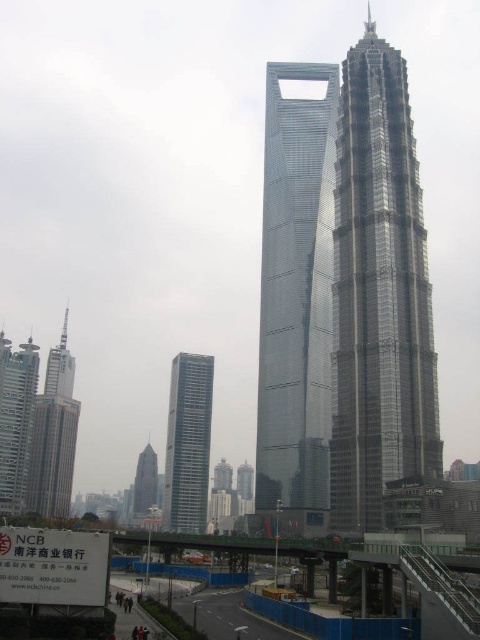
Question: Is shiny glass skyscraper at center thinner than silver glass skyscraper at left?

Choices:
 (A) yes
 (B) no

Answer: (B)

Question: Which object is farther from the camera taking this photo?

Choices:
 (A) shiny glass tower at center
 (B) matte brown skyscraper at center

Answer: (B)

Question: Which of the following is the closest to the observer?

Choices:
 (A) (316, 509)
 (B) (48, 410)
 (C) (144, 449)

Answer: (A)

Question: Can you confirm if shiny glass tower at center is thinner than matte brown skyscraper at center?

Choices:
 (A) no
 (B) yes

Answer: (A)

Question: Which object is closer to the camera taking this photo?

Choices:
 (A) matte brown skyscraper at center
 (B) sleek silver skyscraper at center
 (C) shiny glass skyscraper at center

Answer: (C)

Question: Can you confirm if shiny glass skyscraper at center is positioned to the left of silver glass skyscraper at left?

Choices:
 (A) no
 (B) yes

Answer: (A)